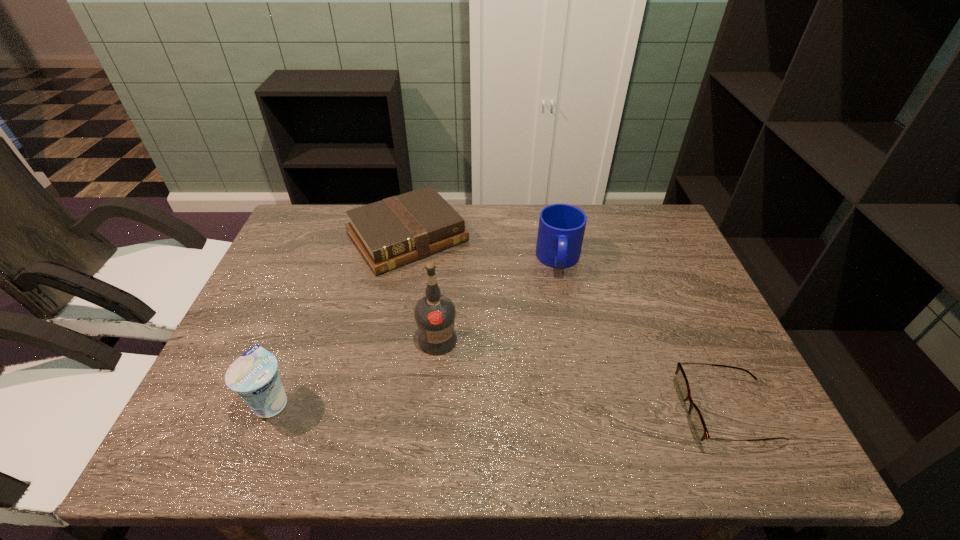
In order to click on empty space that is in between the mug and the Bible in this screenshot , I will do `click(483, 249)`.

This screenshot has width=960, height=540. I want to click on vacant area that lies between the mug and the second shortest object, so click(483, 249).

Locate an element on the screen. vacant area that lies between the fourth object from left to right and the tallest object is located at coordinates (498, 300).

Image resolution: width=960 pixels, height=540 pixels. Identify the location of free area in between the yogurt and the vodka. (355, 370).

Locate which object ranks fourth in proximity to the tallest object. Please provide its 2D coordinates. Your answer should be formatted as a tuple, i.e. [(x, y)], where the tuple contains the x and y coordinates of a point satisfying the conditions above.

[(697, 425)]

You are a GUI agent. You are given a task and a screenshot of the screen. Output one action in this format:
    pyautogui.click(x=<x>, y=<y>)
    Task: Click on the fourth closest object to the Bible
    This screenshot has width=960, height=540.
    Given the screenshot: What is the action you would take?
    pyautogui.click(x=697, y=425)

The image size is (960, 540). I want to click on vacant region that satisfies the following two spatial constraints: 1. on the front side of the spectacles; 2. on the face of the Bible, so click(373, 412).

Locate an element on the screen. This screenshot has width=960, height=540. free location that satisfies the following two spatial constraints: 1. on the front side of the rightmost object; 2. on the face of the yogurt is located at coordinates [268, 412].

Find the location of `vacant region that satisfies the following two spatial constraints: 1. on the front side of the third nearest object; 2. on the right side of the Bible`. vacant region that satisfies the following two spatial constraints: 1. on the front side of the third nearest object; 2. on the right side of the Bible is located at coordinates (388, 340).